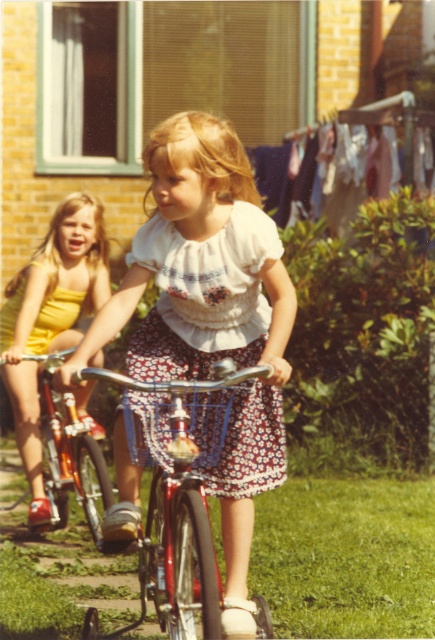
Is the position of shiny metallic bicycle at center less distant than that of cloth fabric clothesline at upper center?

Yes, it is.

Can you confirm if shiny metallic bicycle at center is thinner than cloth fabric clothesline at upper center?

Yes.

Which is behind, point (217, 580) or point (361, 145)?

The point (361, 145) is more distant.

Find the location of a particular element. shiny metallic bicycle at center is located at coordinates (177, 499).

Is point (355, 157) farther from viewer compared to point (106, 476)?

That is True.

Between cloth fabric clothesline at upper center and shiny orange bicycle at left, which one has more height?

shiny orange bicycle at left

Where is `cloth fabric clothesline at upper center`? The height and width of the screenshot is (640, 435). cloth fabric clothesline at upper center is located at coordinates (323, 173).

Does matte white blouse at center come behind floral cotton dress at center?

No.

Which is below, matte white blouse at center or floral cotton dress at center?

matte white blouse at center is below.

Is point (231, 348) in front of point (197, 368)?

Yes, point (231, 348) is in front of point (197, 368).

You are a GUI agent. You are given a task and a screenshot of the screen. Output one action in this format:
    pyautogui.click(x=<x>, y=<y>)
    Task: Click on the matte white blouse at center
    This screenshot has height=640, width=435.
    Given the screenshot: What is the action you would take?
    pyautogui.click(x=210, y=321)